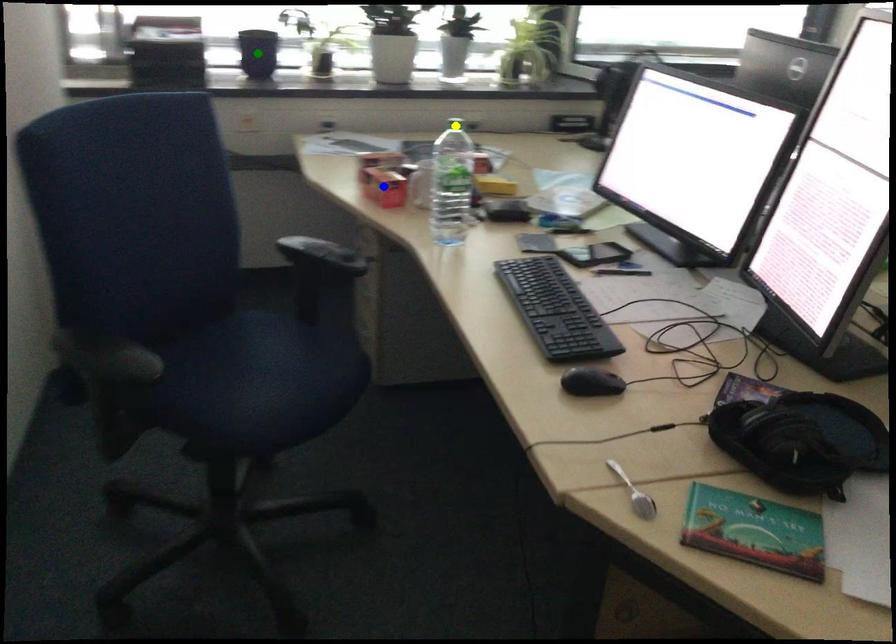
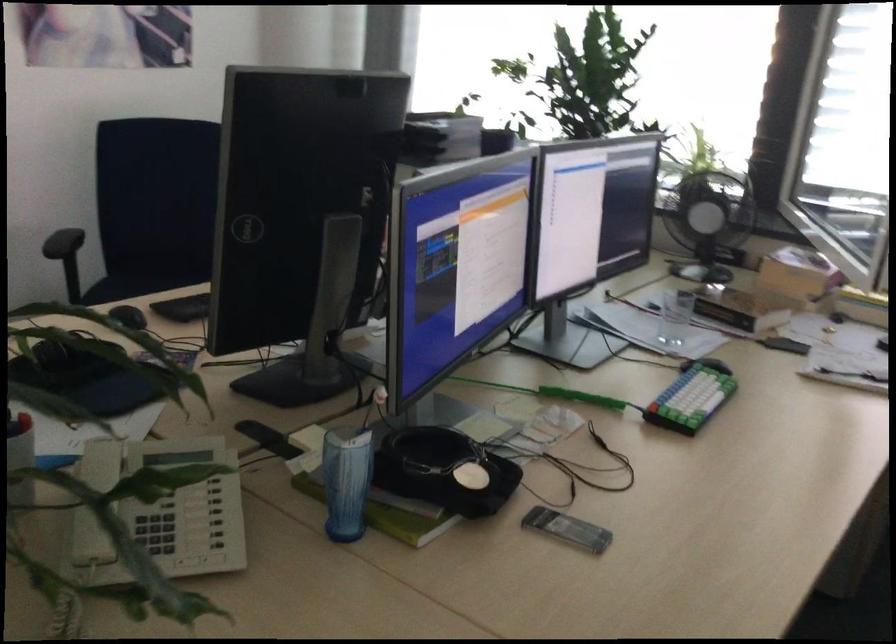
I am providing you with two images of the same scene from different viewpoints. Three points are marked in image1. Which point corresponds to a part or object that is occluded in image2?In image1, three points are marked. Which of them correspond to a part or object that is occluded in image2?Among the three points shown in image1, which one corresponds to a part or object that is no longer visible due to occlusion in image2?

Invisible in image2: green point, yellow point, blue point.